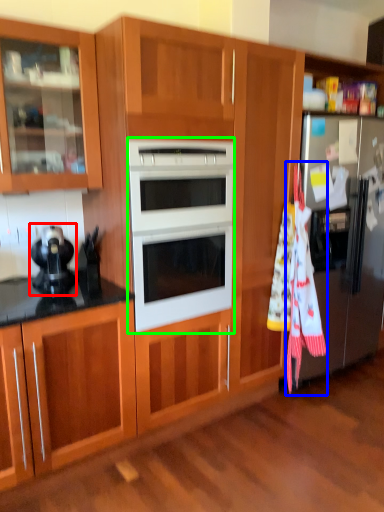
Question: Which object is positioned farthest from appliance (highlighted by a red box)? Select from beach towel (highlighted by a blue box) and microwave oven (highlighted by a green box).

Choices:
 (A) beach towel
 (B) microwave oven

Answer: (A)